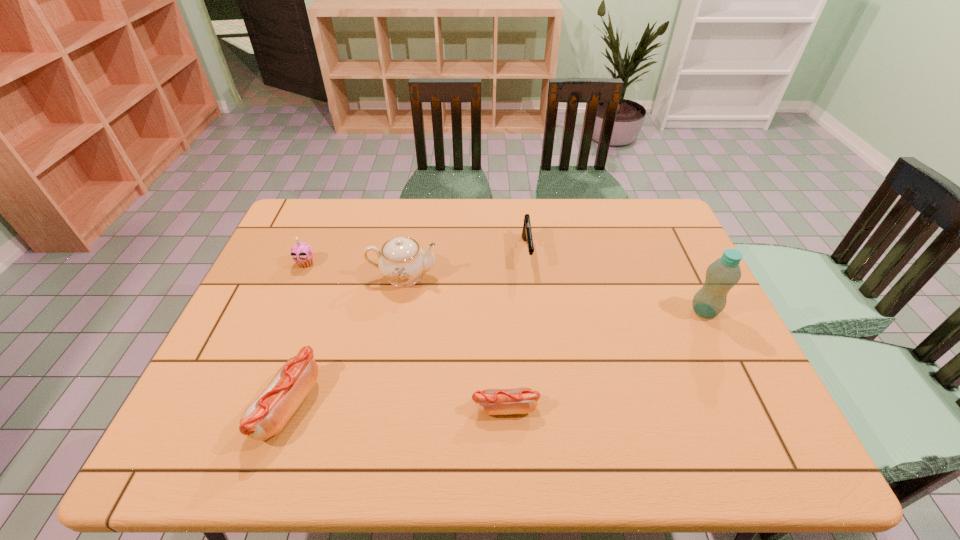
Locate an element on the screen. The height and width of the screenshot is (540, 960). cupcake that is at the left edge is located at coordinates click(301, 253).

Where is `object that is at the right edge`? This screenshot has height=540, width=960. object that is at the right edge is located at coordinates click(x=723, y=274).

Image resolution: width=960 pixels, height=540 pixels. In order to click on object positioned at the near left corner in this screenshot , I will do `click(267, 415)`.

Image resolution: width=960 pixels, height=540 pixels. I want to click on vacant position at the far edge of the desktop, so click(x=471, y=234).

Where is `free space at the near edge`? The height and width of the screenshot is (540, 960). free space at the near edge is located at coordinates (459, 384).

You are a GUI agent. You are given a task and a screenshot of the screen. Output one action in this format:
    pyautogui.click(x=<x>, y=<y>)
    Task: Click on the vacant space at the left edge
    The height and width of the screenshot is (540, 960).
    Given the screenshot: What is the action you would take?
    pyautogui.click(x=237, y=352)

Find the location of `vacant space at the far left corner of the desktop`. vacant space at the far left corner of the desktop is located at coordinates (296, 211).

This screenshot has height=540, width=960. In order to click on vacant space at the near left corner of the desktop in this screenshot , I will do `click(236, 386)`.

You are a GUI agent. You are given a task and a screenshot of the screen. Output one action in this format:
    pyautogui.click(x=<x>, y=<y>)
    Task: Click on the empty space between the third object from left to right and the rightmost object
    
    Given the screenshot: What is the action you would take?
    pyautogui.click(x=554, y=294)

This screenshot has width=960, height=540. I want to click on vacant area that lies between the fifth object from right to left and the second object from right to left, so click(407, 329).